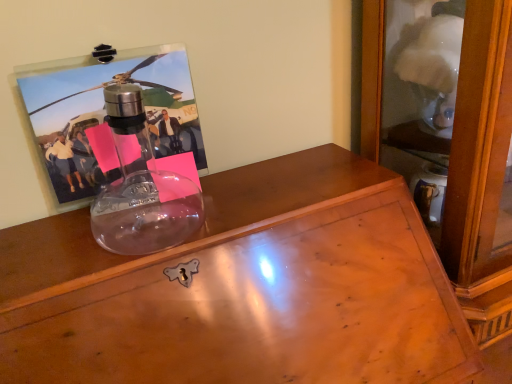
What are the coordinates of `free space in front of clear plastic frame at upper left` in the screenshot? It's located at pyautogui.click(x=108, y=249).